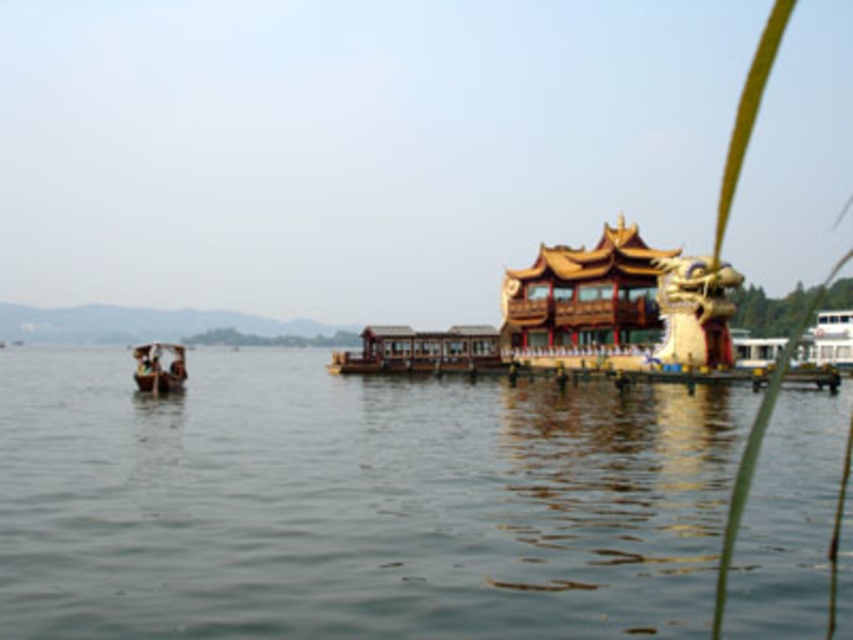
Question: Can you confirm if transparent water at center is positioned below wooden boat at left?

Choices:
 (A) no
 (B) yes

Answer: (B)

Question: Is transparent water at center below wooden boat at left?

Choices:
 (A) yes
 (B) no

Answer: (A)

Question: Which point appears farthest from the camera in this image?

Choices:
 (A) (134, 352)
 (B) (117, 593)

Answer: (A)

Question: Among these points, which one is nearest to the camera?

Choices:
 (A) pyautogui.click(x=109, y=508)
 (B) pyautogui.click(x=170, y=381)

Answer: (A)

Question: Is transparent water at center wider than wooden boat at left?

Choices:
 (A) no
 (B) yes

Answer: (B)